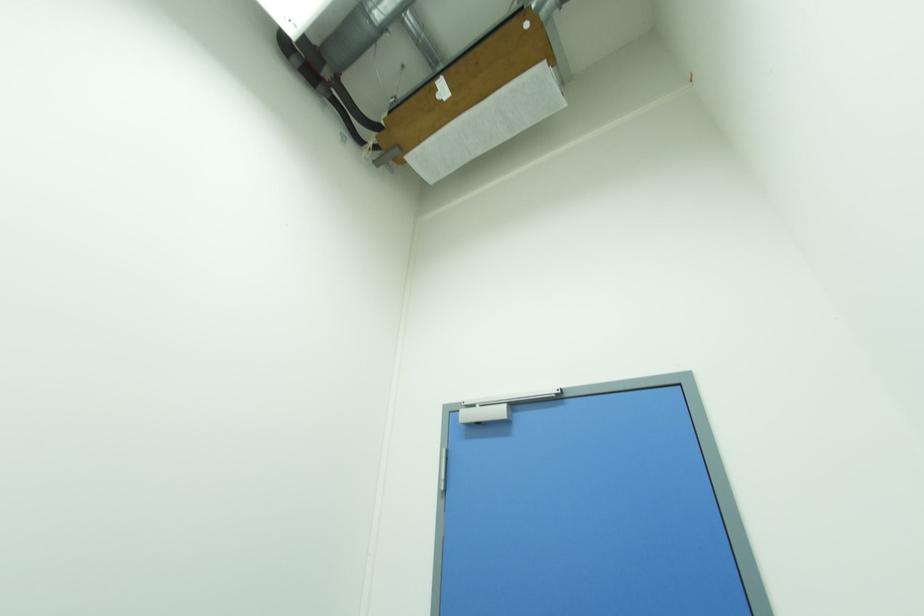
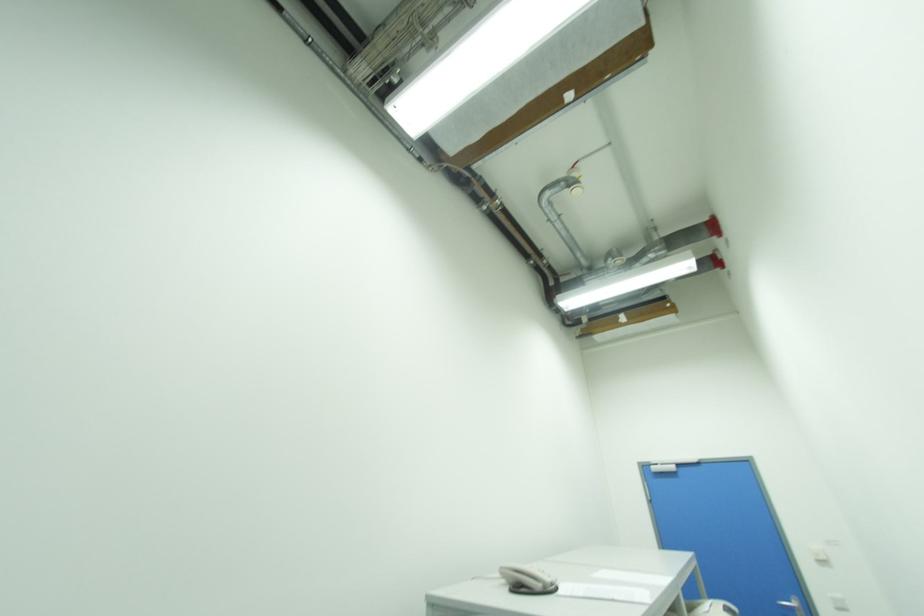
The images are taken continuously from a first-person perspective. In which direction are you moving?

The cameraman walked toward left, backward.